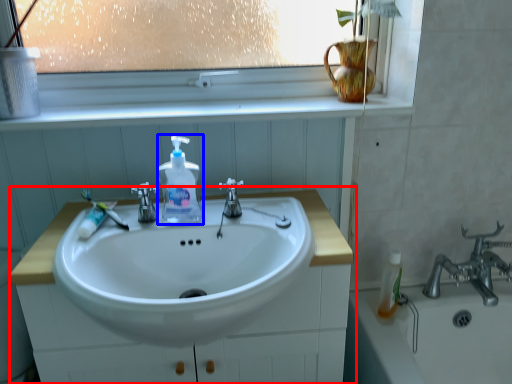
Question: Which object appears farthest to the camera in this image, bathroom cabinet (highlighted by a red box) or soap dispenser (highlighted by a blue box)?

Choices:
 (A) bathroom cabinet
 (B) soap dispenser

Answer: (B)